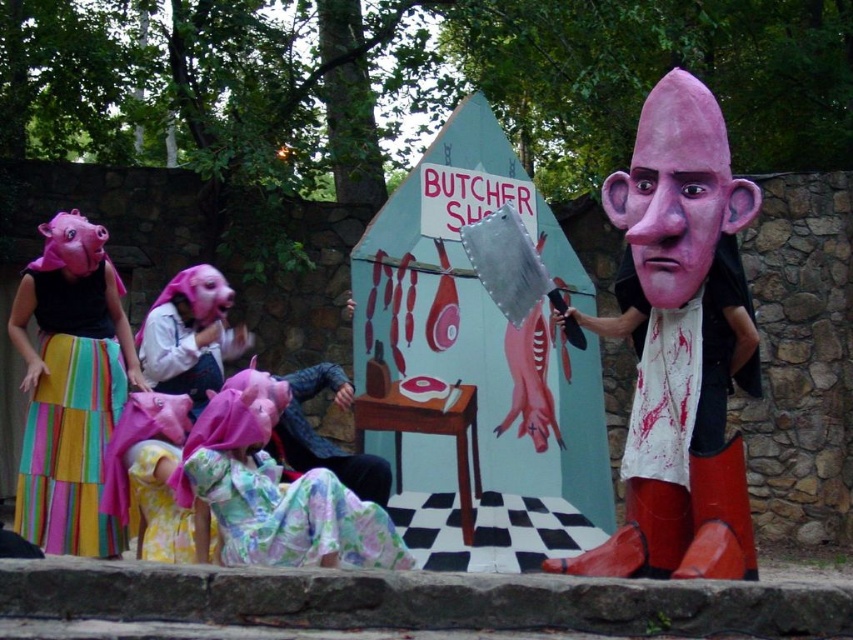
Between multicolored fabric skirt at left and smooth plastic head at center right, which one is positioned lower?

Positioned lower is multicolored fabric skirt at left.

Is the position of multicolored fabric skirt at left more distant than that of smooth plastic head at center right?

Yes, multicolored fabric skirt at left is behind smooth plastic head at center right.

Measure the distance between multicolored fabric skirt at left and camera.

multicolored fabric skirt at left and camera are 57.32 meters apart.

Locate an element on the screen. multicolored fabric skirt at left is located at coordinates (71, 404).

The image size is (853, 640). Identify the location of multicolored fabric skirt at left. pyautogui.click(x=71, y=404).

Where is `multicolored fabric skirt at left`? multicolored fabric skirt at left is located at coordinates (71, 404).

Who is more distant from viewer, (604,195) or (56,472)?

Positioned behind is point (56,472).

Between point (627, 234) and point (36, 278), which one is positioned in front?

Point (627, 234) is more forward.

Which is behind, point (677, 244) or point (102, 308)?

The point (102, 308) is behind.

Identify the location of matte pink head at right. The width and height of the screenshot is (853, 640). (679, 342).